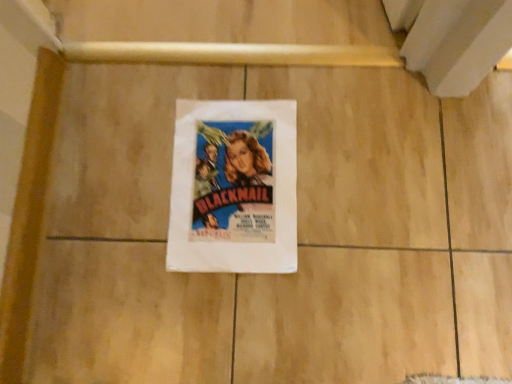
Locate an element on the screen. This screenshot has height=384, width=512. free spot above vintage paper poster at center (from a real-world perspective) is located at coordinates (237, 176).